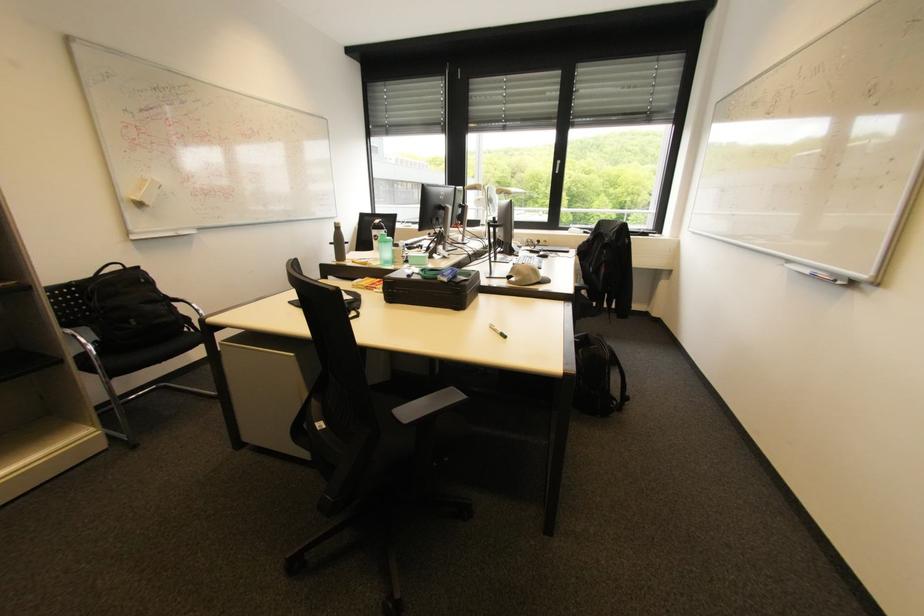
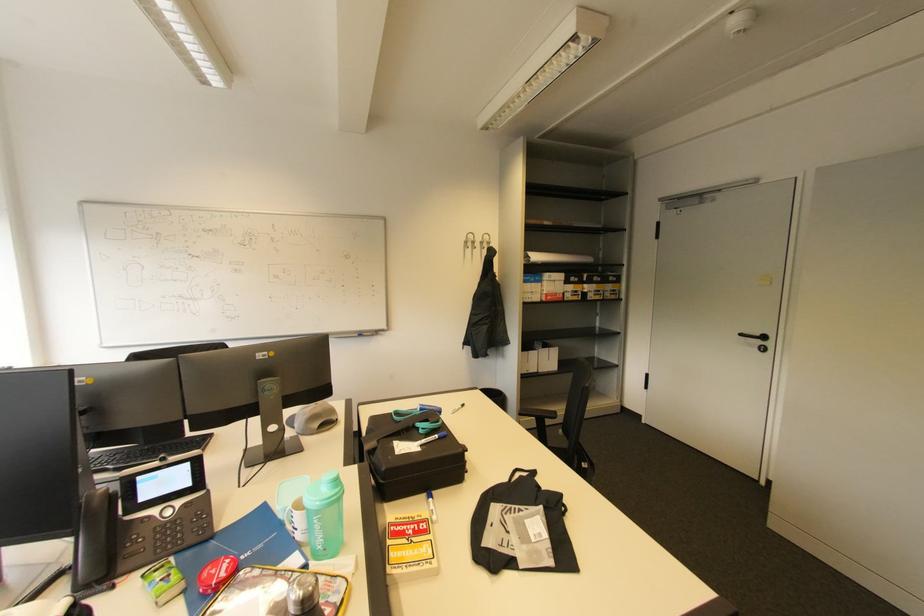
Question: I am providing you with two images of the same scene from different viewpoints. Which of the following objects are not visible in image2?

Choices:
 (A) black backpack
 (B) blue notebook
 (C) white egg carton
 (D) blue marker

Answer: (A)